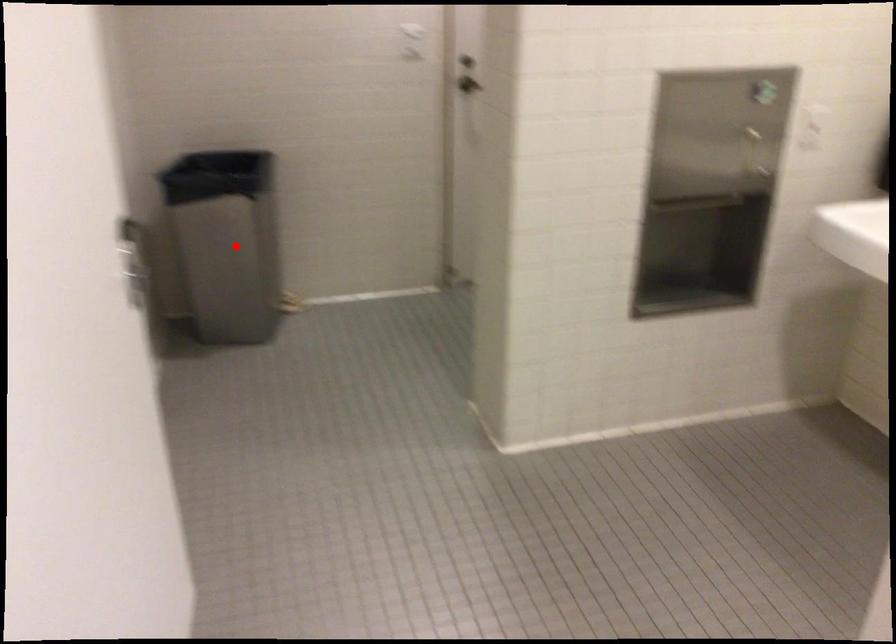
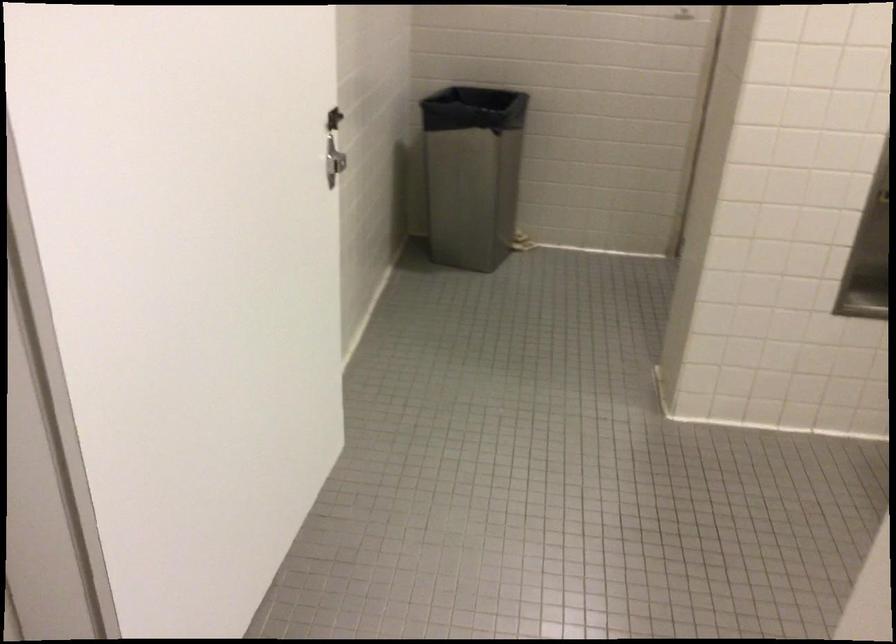
Question: I am providing you with two images of the same scene from different viewpoints. A red point is marked on the first image. Is the red point's position out of view in image 2?

Choices:
 (A) Yes
 (B) No

Answer: (B)